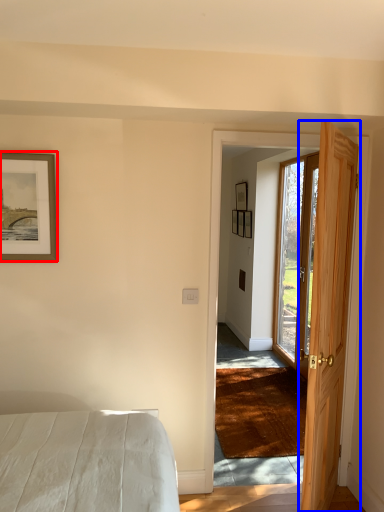
Question: Which point is closer to the camera, picture frame (highlighted by a red box) or door (highlighted by a blue box)?

Choices:
 (A) picture frame
 (B) door

Answer: (B)